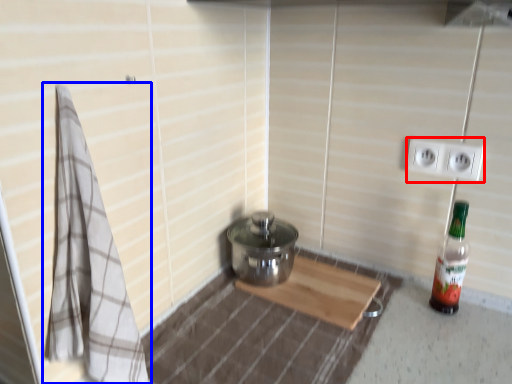
Question: Which object appears closest to the camera in this image, electric outlet (highlighted by a red box) or bath towel (highlighted by a blue box)?

Choices:
 (A) electric outlet
 (B) bath towel

Answer: (B)